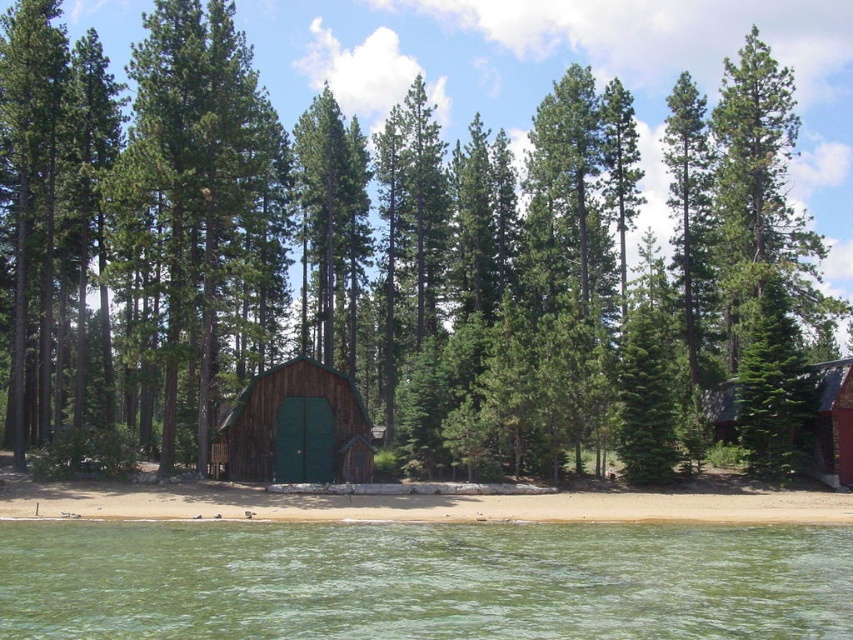
Question: Observing the image, what is the correct spatial positioning of green woodshed at center in reference to red brick cabin at right?

Choices:
 (A) below
 (B) above

Answer: (B)

Question: Among these points, which one is nearest to the camera?

Choices:
 (A) (728, 385)
 (B) (245, 448)

Answer: (B)

Question: Which object appears closest to the camera in this image?

Choices:
 (A) green woodshed at center
 (B) green water at lower center

Answer: (B)

Question: Estimate the real-world distances between objects in this image. Which object is closer to the green woodshed at center?

Choices:
 (A) sandy shore at lower center
 (B) green water at lower center

Answer: (A)

Question: Is the position of green woodshed at center less distant than that of red brick cabin at right?

Choices:
 (A) no
 (B) yes

Answer: (A)

Question: Is sandy shore at lower center further to camera compared to red brick cabin at right?

Choices:
 (A) no
 (B) yes

Answer: (A)